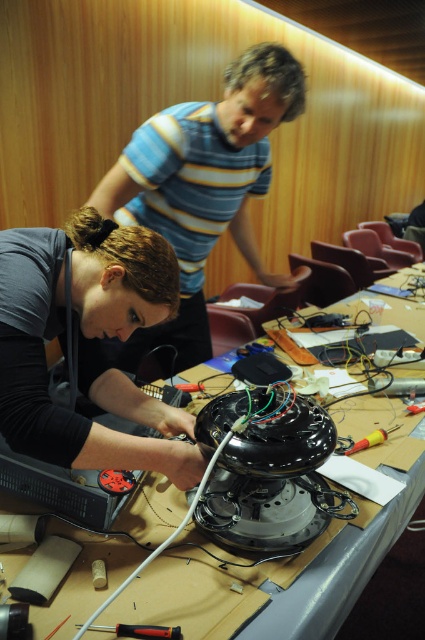
You are an engineer trying to locate the person with matte black hair at lower left in the image. What are their coordinates?

The coordinates of matte black hair at lower left are at point (87,344).